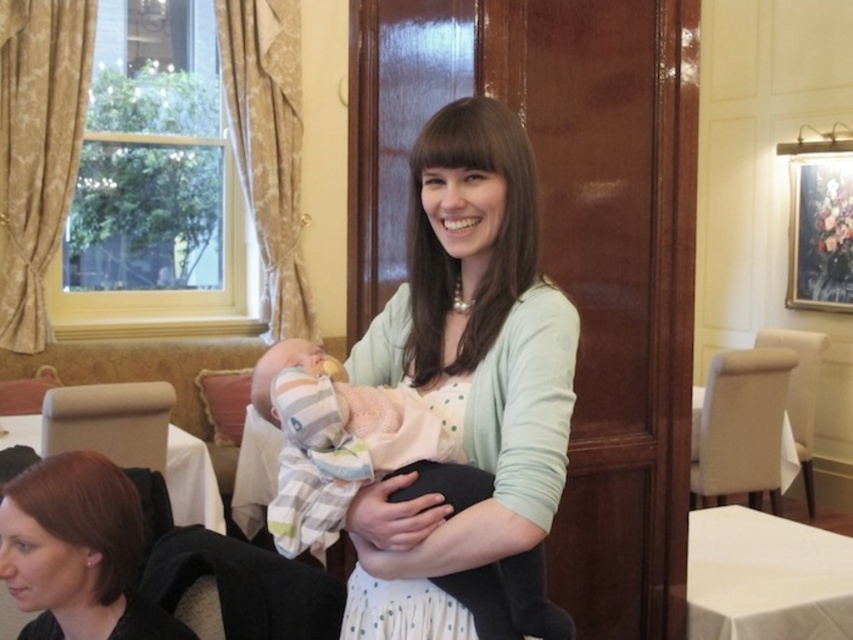
Between light green cardigan at center and striped cotton blanket at center, which one is positioned lower?

Positioned lower is striped cotton blanket at center.

Does light green cardigan at center have a smaller size compared to striped cotton blanket at center?

Actually, light green cardigan at center might be larger than striped cotton blanket at center.

You are a GUI agent. You are given a task and a screenshot of the screen. Output one action in this format:
    pyautogui.click(x=<x>, y=<y>)
    Task: Click on the light green cardigan at center
    The width and height of the screenshot is (853, 640).
    Given the screenshot: What is the action you would take?
    pyautogui.click(x=465, y=372)

This screenshot has height=640, width=853. Identify the location of light green cardigan at center. (465, 372).

Is smooth black hair at lower left to the left of striped cotton blanket at center from the viewer's perspective?

Yes, smooth black hair at lower left is to the left of striped cotton blanket at center.

Who is more distant from viewer, (57,525) or (310,499)?

The point (57,525) is more distant.

The image size is (853, 640). In order to click on smooth black hair at lower left in this screenshot , I will do 78,552.

Is smooth black hair at lower left wider than white cloth at lower right?

No.

Between point (96, 576) and point (804, 525), which one is positioned behind?

The point (804, 525) is more distant.

You are a GUI agent. You are given a task and a screenshot of the screen. Output one action in this format:
    pyautogui.click(x=<x>, y=<y>)
    Task: Click on the smooth black hair at lower left
    The width and height of the screenshot is (853, 640).
    Given the screenshot: What is the action you would take?
    78,552